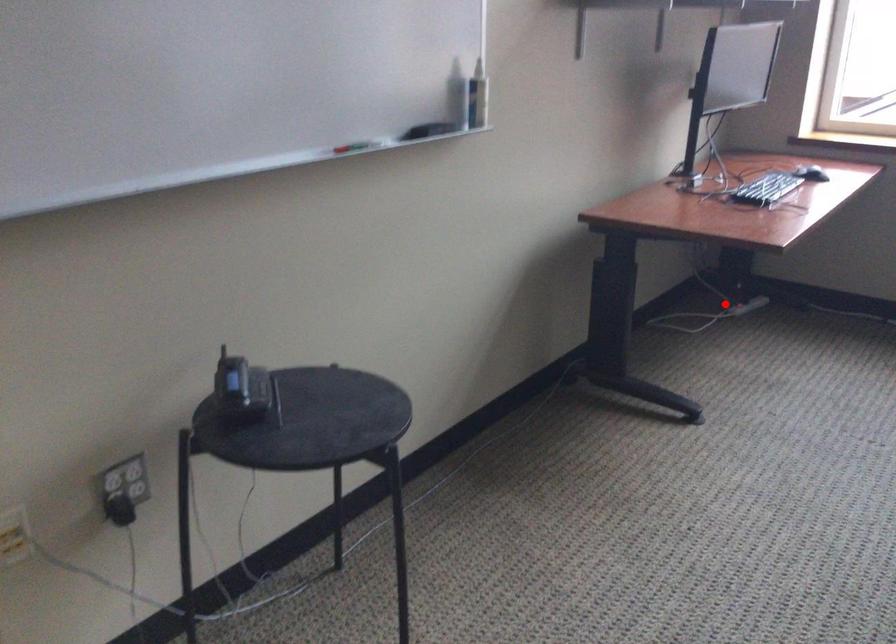
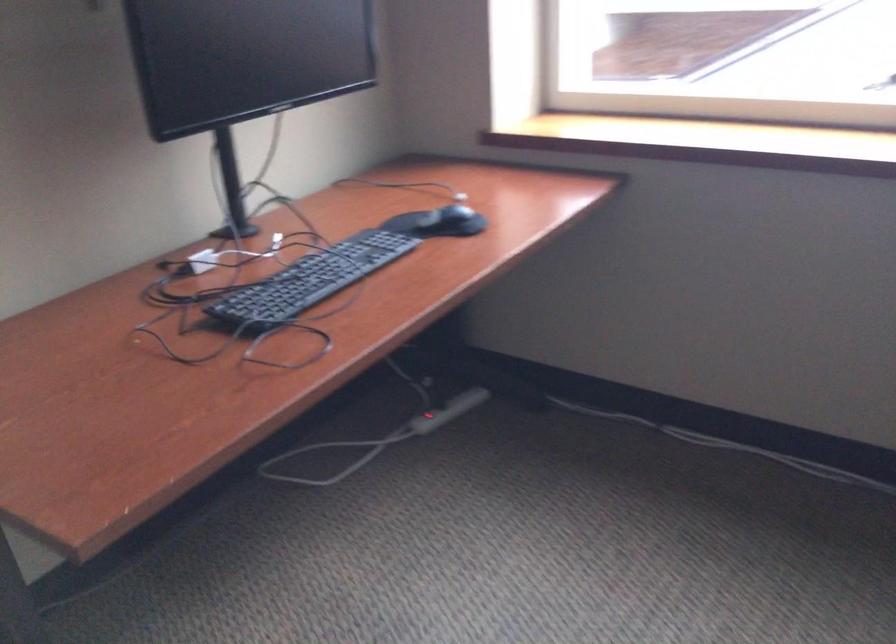
Question: I am providing you with two images of the same scene from different viewpoints. A red point is marked on the first image. Is the red point's position out of view in image 2?

Choices:
 (A) Yes
 (B) No

Answer: (B)